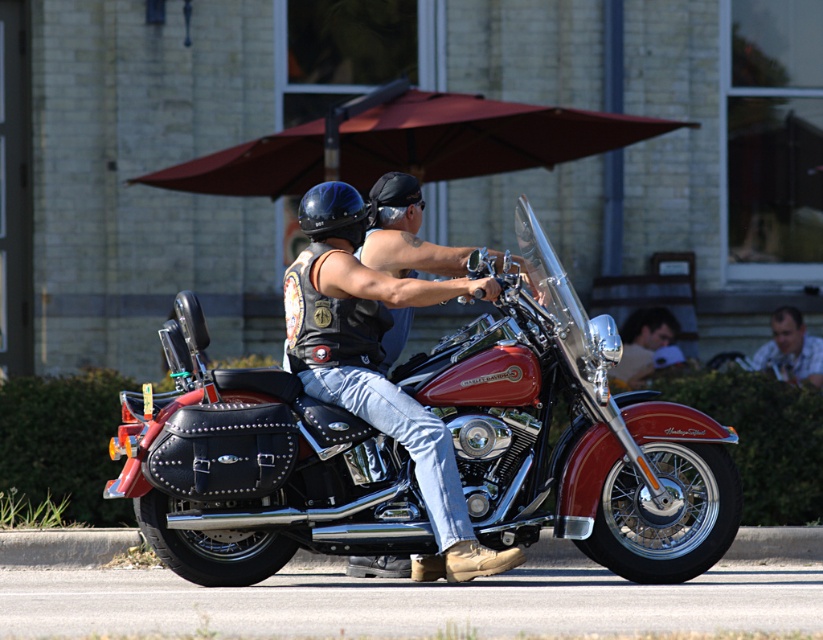
Which is behind, point (375, 380) or point (291, 275)?

The point (291, 275) is more distant.

What do you see at coordinates (384, 371) in the screenshot? I see `matte black vest at center` at bounding box center [384, 371].

This screenshot has height=640, width=823. Identify the location of matte black vest at center. (384, 371).

Consider the image. Does matte black vest at center have a greater width compared to blue matte helmet at upper center?

Indeed, matte black vest at center has a greater width compared to blue matte helmet at upper center.

Identify the location of matte black vest at center. (384, 371).

Image resolution: width=823 pixels, height=640 pixels. I want to click on matte black vest at center, so click(384, 371).

In the scene shown: Can you confirm if maroon fabric umbrella at upper center is positioned below blue matte helmet at upper center?

Actually, maroon fabric umbrella at upper center is above blue matte helmet at upper center.

Based on the photo, is maroon fabric umbrella at upper center to the left of blue matte helmet at upper center from the viewer's perspective?

In fact, maroon fabric umbrella at upper center is to the right of blue matte helmet at upper center.

Image resolution: width=823 pixels, height=640 pixels. I want to click on maroon fabric umbrella at upper center, so click(x=408, y=144).